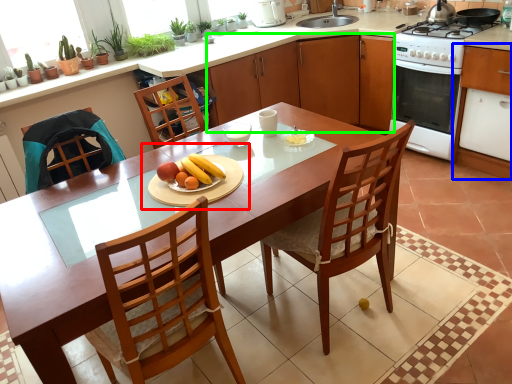
Question: Which object is the farthest from fruit dish (highlighted by a red box)? Choose among these: cabinetry (highlighted by a blue box) or cabinetry (highlighted by a green box).

Choices:
 (A) cabinetry
 (B) cabinetry

Answer: (A)